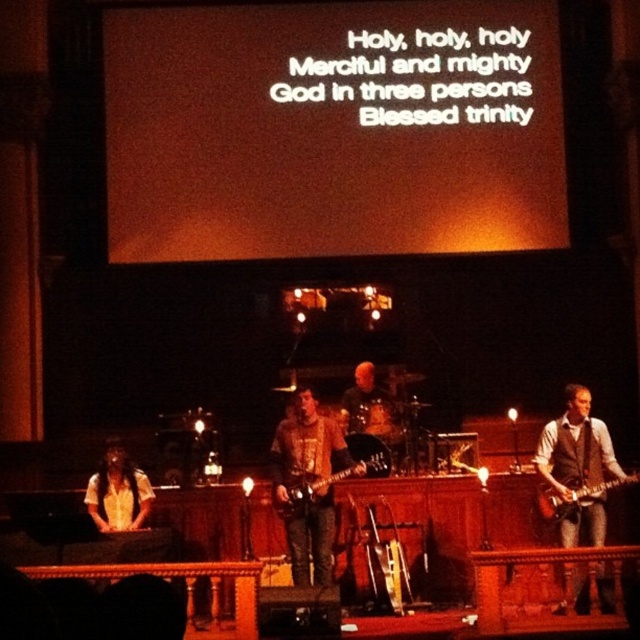
Looking at this image, you are a stagehand who needs to transport both the brown leather guitar at center and the glossy electric guitar at right to the storage room. The storage room has a shelf that can only hold items up to 1.2 meters in length. Can both guitars fit on the shelf if placed side by side?

The brown leather guitar at center is larger than the glossy electric guitar at right. However, the exact dimensions are not provided. Without knowing their individual lengths, it is impossible to determine if their combined length exceeds 1.2 meters. Additional measurements are needed.

You are a stagehand who needs to place a microphone stand exactly at the position of the brown leather guitar at center. What are the coordinates where you should place it?

The brown leather guitar at center is located at point [308,484], so you should place the microphone stand at those coordinates.